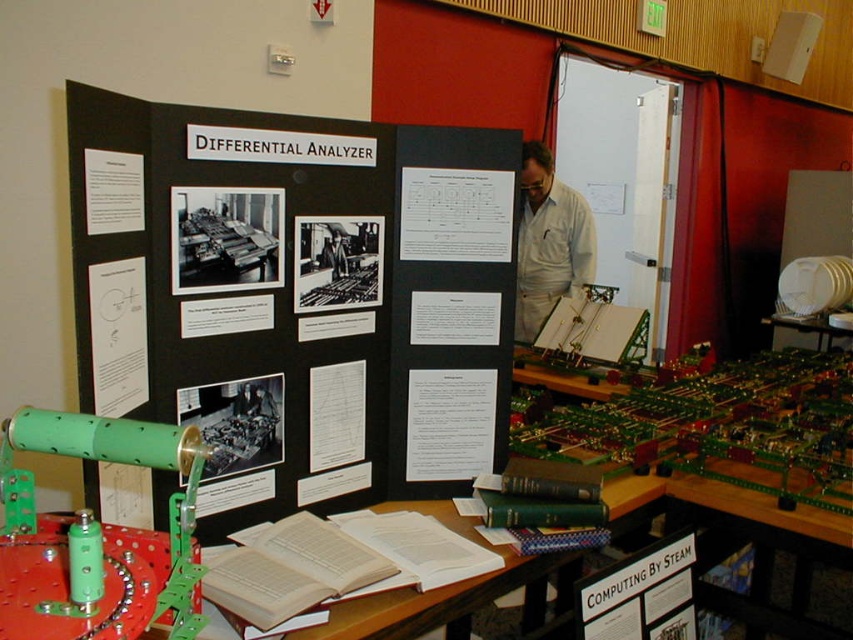
You are organizing an exhibition and need to place a new label next to the white paper at upper left and the light brown leather jacket at center. If the label for the white paper requires 20 cm of space, will it fit next to the jacket without overlapping?

The white paper at upper left is narrower than the light brown leather jacket at center. Since the label requires 20 cm, and the white paper is narrower, there should be enough space to place the label next to the jacket without overlapping.

You are standing in front of the display about the differential analyzer. You see a white paper at upper left and a light brown leather jacket at center. Which object is nearer to you?

The white paper at upper left is closer to the viewer than the light brown leather jacket at center.

You are an event organizer checking the display setup. You need to ensure that the green matte cylinder at center and the black paperboard at center are visible to visitors standing at the back of the room. Considering their sizes, which object might require positioning closer to the front for better visibility?

The black paperboard at center is smaller in size compared to the green matte cylinder at center. Since the black paperboard at center is smaller, it might need to be positioned closer to the front to ensure visitors can see it clearly from the back.